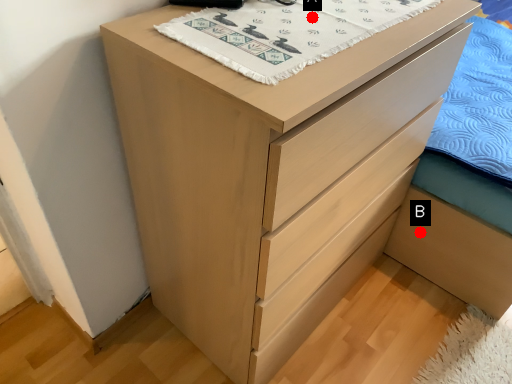
Question: Two points are circled on the image, labeled by A and B beside each circle. Among these points, which one is farthest from the camera?

Choices:
 (A) A is further
 (B) B is further

Answer: (B)